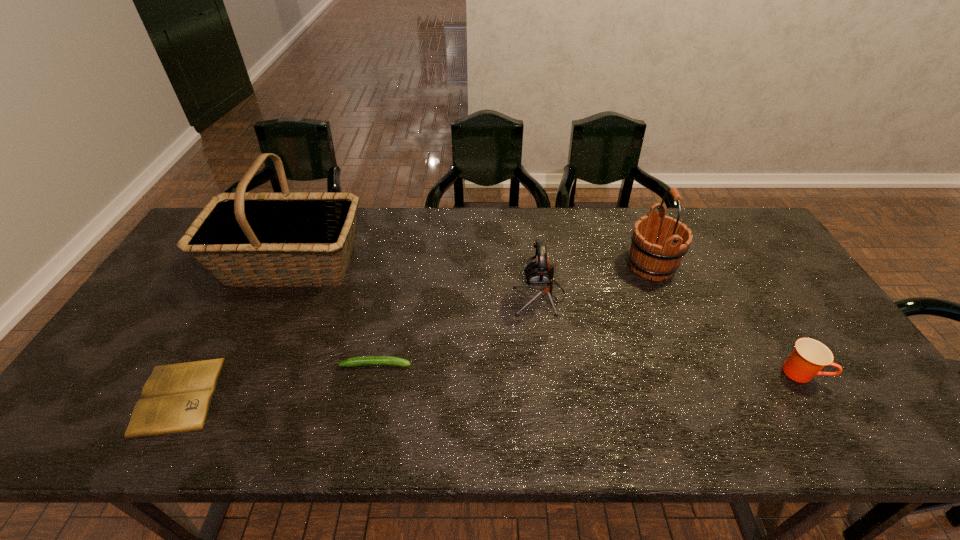
Locate an element on the screen. Image resolution: width=960 pixels, height=540 pixels. free space located 0.350m by the handle of the tallest object is located at coordinates (475, 264).

This screenshot has height=540, width=960. Identify the location of free space located on the back of the fifth object from left to right. (636, 230).

Find the location of a particular element. This screenshot has height=540, width=960. vacant space located on the front of the third object from right to left is located at coordinates (551, 383).

I want to click on free space located 0.100m on the right of the third shortest object, so click(861, 372).

Image resolution: width=960 pixels, height=540 pixels. I want to click on vacant space located 0.050m on the front-facing side of the third object from left to right, so click(x=432, y=364).

In order to click on vacant area located on the left of the shortest object in this screenshot , I will do `click(100, 396)`.

Locate an element on the screen. Image resolution: width=960 pixels, height=540 pixels. basket situated at the far edge is located at coordinates (225, 239).

The image size is (960, 540). In order to click on wine bucket that is at the far edge in this screenshot , I will do `click(659, 243)`.

Identify the location of object that is at the near edge. pyautogui.click(x=176, y=398).

Image resolution: width=960 pixels, height=540 pixels. I want to click on basket at the left edge, so click(x=225, y=239).